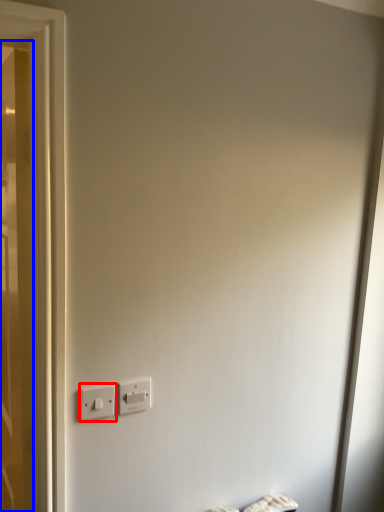
Question: Among these objects, which one is nearest to the camera, power plugs and sockets (highlighted by a red box) or door (highlighted by a blue box)?

Choices:
 (A) power plugs and sockets
 (B) door

Answer: (B)